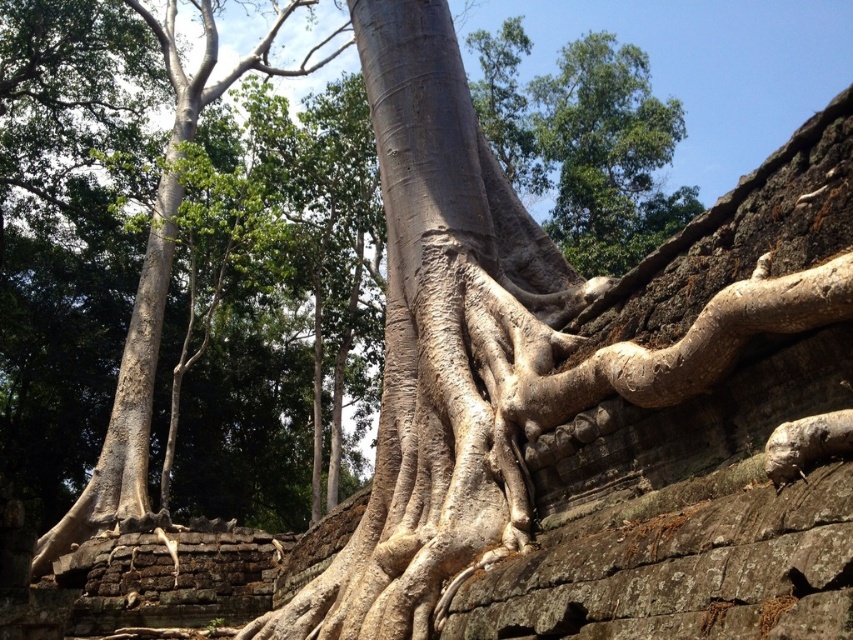
Which is above, smooth gray bark at center or bark-like textured roots at center-right?

Positioned higher is bark-like textured roots at center-right.

Identify the location of smooth gray bark at center. (444, 346).

This screenshot has height=640, width=853. Identify the location of smooth gray bark at center. (444, 346).

Who is higher up, smooth gray bark at center or smooth gray bark at left?

smooth gray bark at left is higher up.

Identify the location of smooth gray bark at center. (444, 346).

Which is above, smooth gray bark at left or bark-like textured roots at center-right?

smooth gray bark at left is higher up.

Does smooth gray bark at left appear under bark-like textured roots at center-right?

Incorrect, smooth gray bark at left is not positioned below bark-like textured roots at center-right.

Where is `smooth gray bark at left`? smooth gray bark at left is located at coordinates (155, 285).

At what (x,y) coordinates should I click in order to perform the action: click on smooth gray bark at left. Please return your answer as a coordinate pair (x, y). The width and height of the screenshot is (853, 640). Looking at the image, I should click on (155, 285).